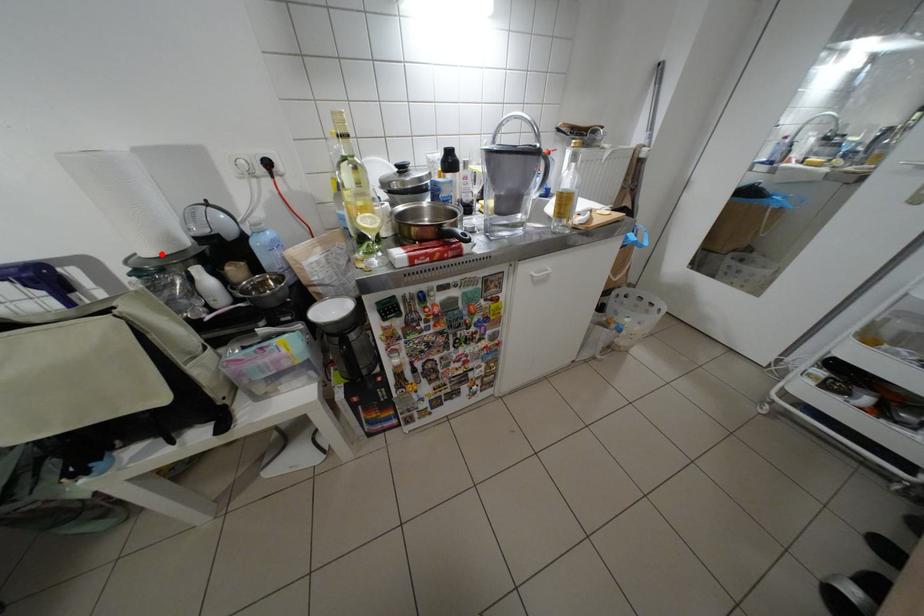
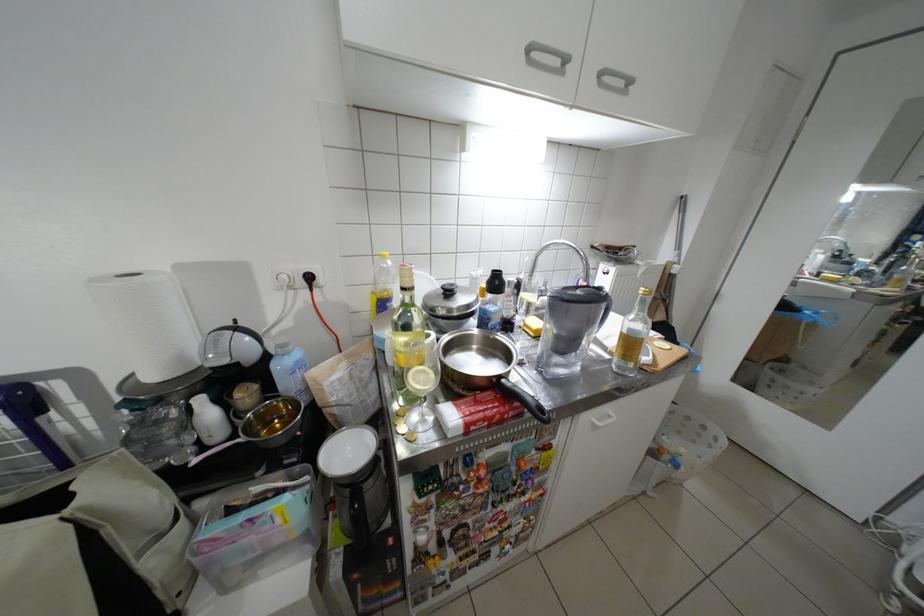
Find the pixel in the second image that matches the highlighted location in the first image.

(164, 378)